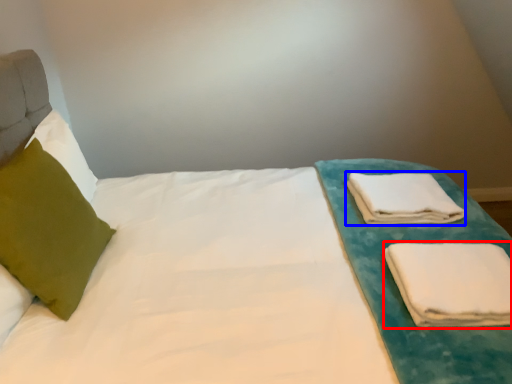
Question: Which object is closer to the camera taking this photo, cloth (highlighted by a red box) or cloth (highlighted by a blue box)?

Choices:
 (A) cloth
 (B) cloth

Answer: (A)